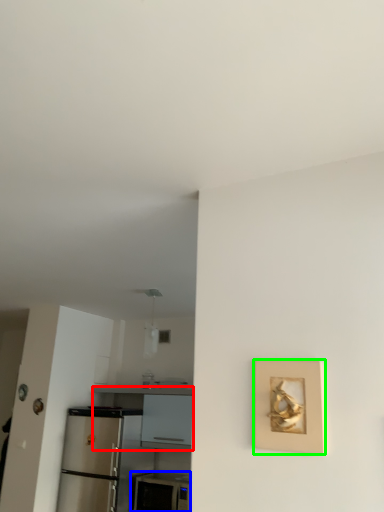
Question: Which object is the farthest from counter (highlighted by a red box)? Choose among these: appliance (highlighted by a blue box) or picture frame (highlighted by a green box).

Choices:
 (A) appliance
 (B) picture frame

Answer: (B)